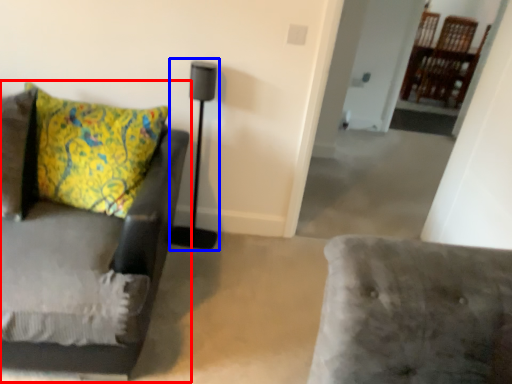
Question: Which object appears farthest to the camera in this image, studio couch (highlighted by a red box) or table lamp (highlighted by a blue box)?

Choices:
 (A) studio couch
 (B) table lamp

Answer: (B)